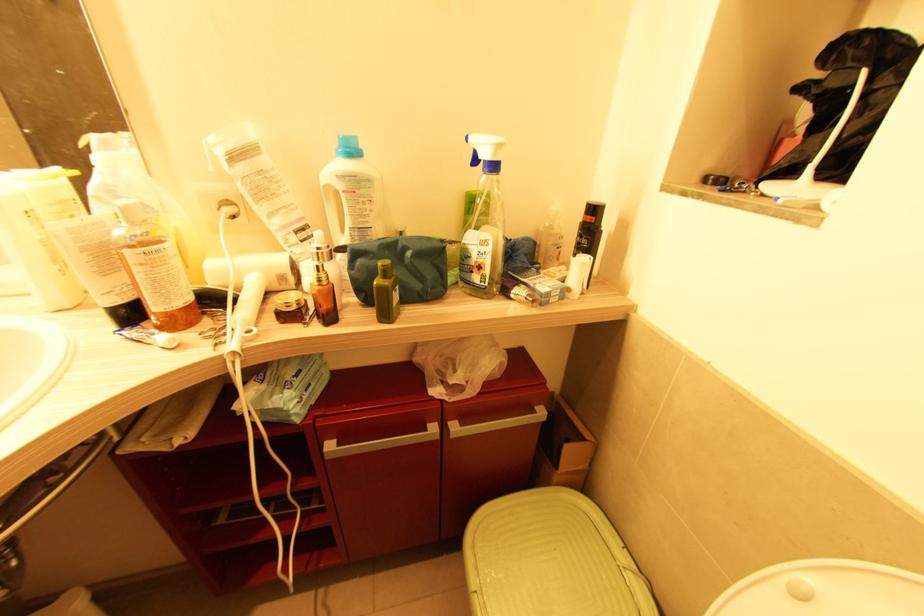
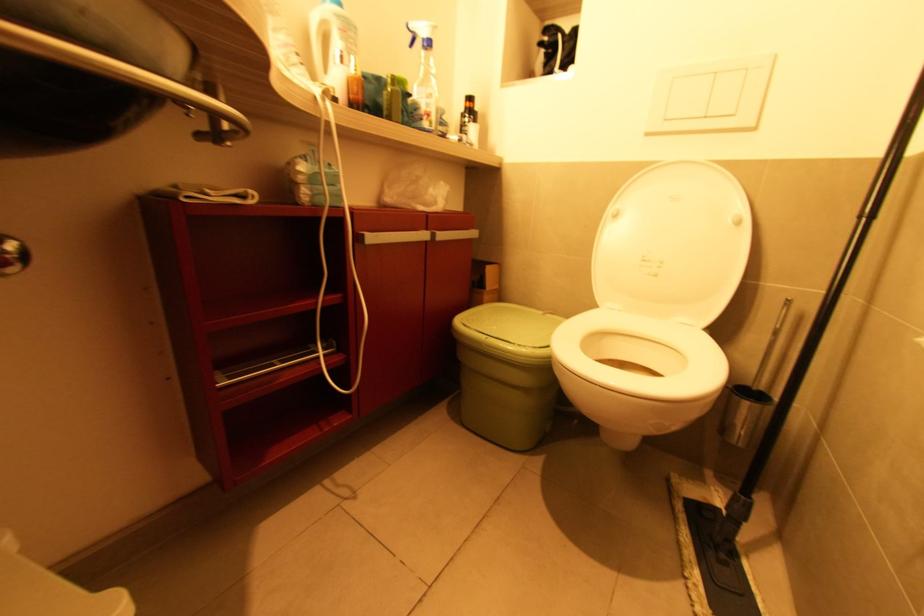
Find the pixel in the second image that matches point 473,273 in the first image.

(424, 121)